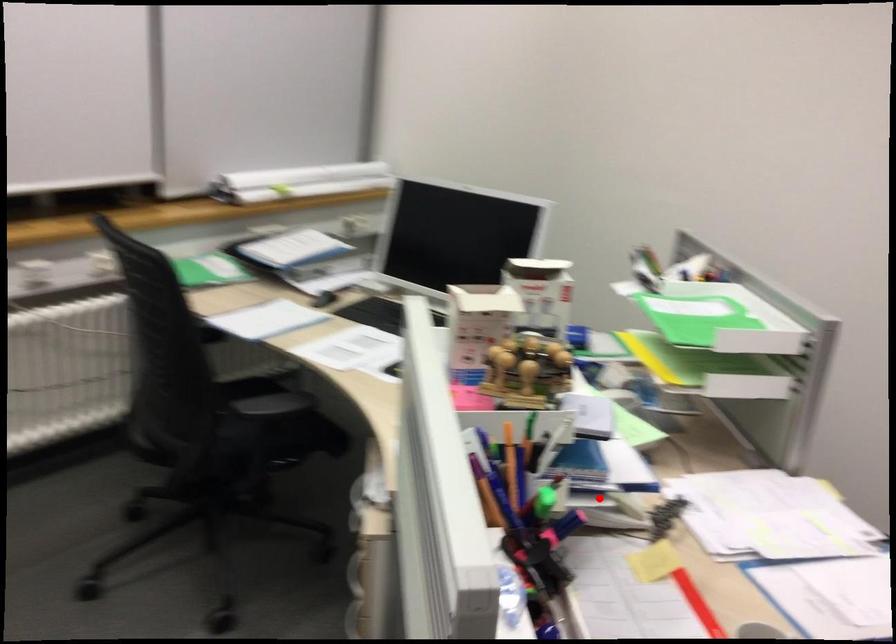
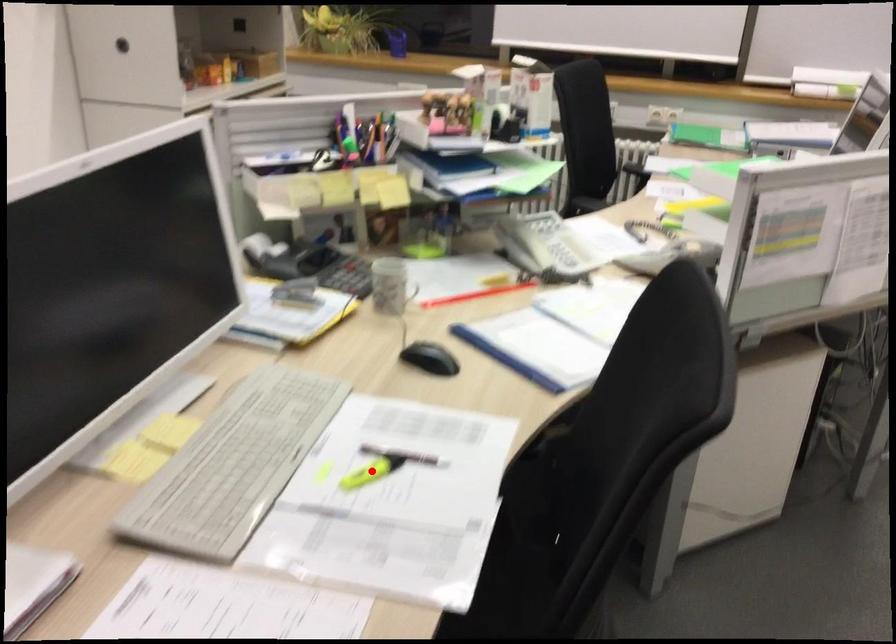
I am providing you with two images of the same scene from different viewpoints. A red point is marked on the first image and another point is marked on the second image. Are the points marked in image1 and image2 representing the same 3D position?

No